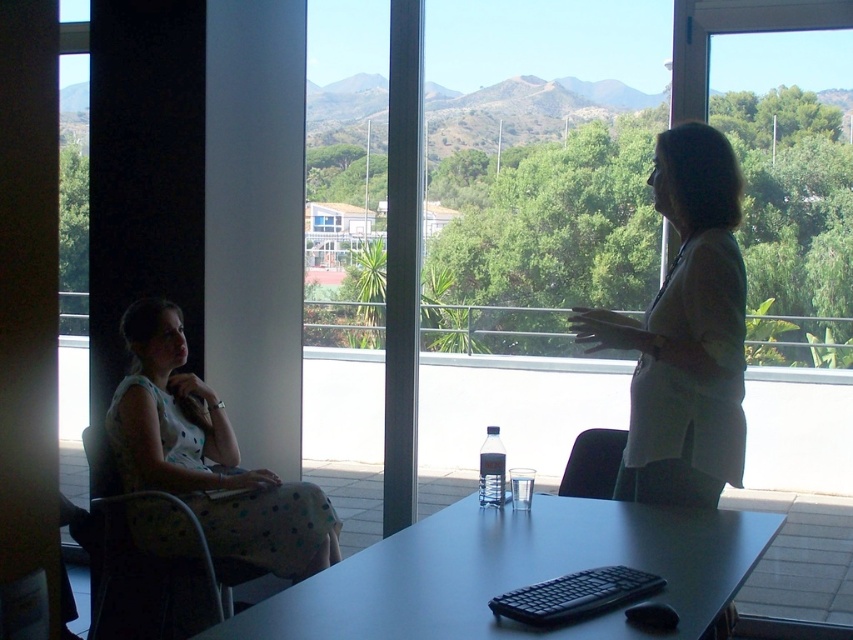
You are a delivery person who needs to place a small package between the white fabric shirt at upper right and the black plastic chair at lower center. The package is 12 inches long. Can you fit it in the space between them?

The distance between the white fabric shirt at upper right and the black plastic chair at lower center is 20.56 inches. Since the package is 12 inches long, it can fit in the space between them as there is enough room.

You are sitting in the black plastic chair at lower center and want to look outside. Is the transparent glass window at upper right positioned above you so you can see through it?

The transparent glass window at upper right is above the black plastic chair at lower center, so yes, you can see through it while sitting there.